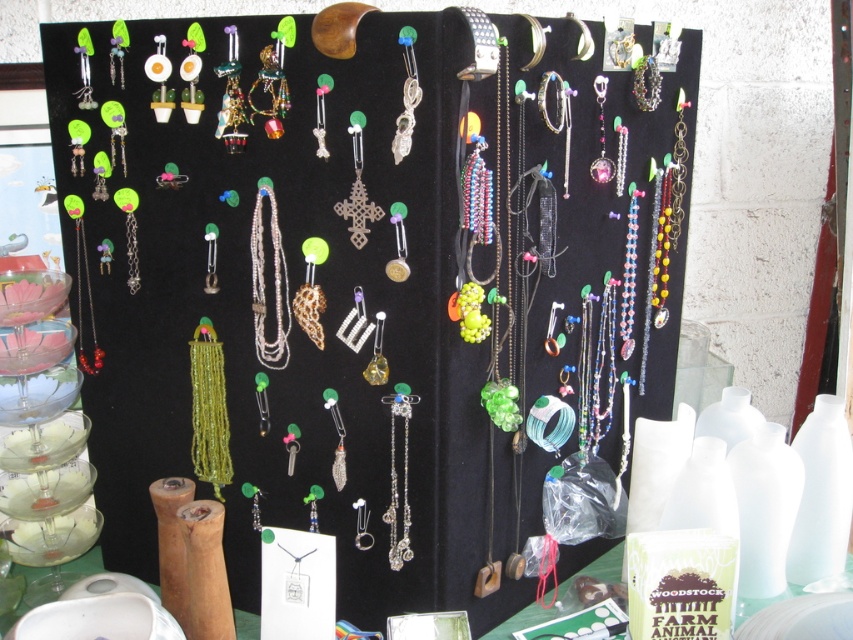
You are a customer at a jewelry stall and see both the green beaded necklace at center and the clear crystal pendant at center hanging on the same hook. Which one would you need to look up higher to see?

The green beaded necklace at center is taller than the clear crystal pendant at center, so you would need to look up higher to see the green beaded necklace at center since it is positioned higher on the hook.

You are a customer at the jewelry stall. You notice two points marked on the display. Which point is closer to you, point (276, 284) or point (393, 492)?

Point (393, 492) is closer to you because the Objects Description states that point (276, 284) is behind point (393, 492).

You are a customer at a jewelry stall and want to know which item is wider between the silver metallic chain at center and the clear crystal pendant at center. Could you tell me which one is wider?

The silver metallic chain at center is wider than the clear crystal pendant at center according to the description.